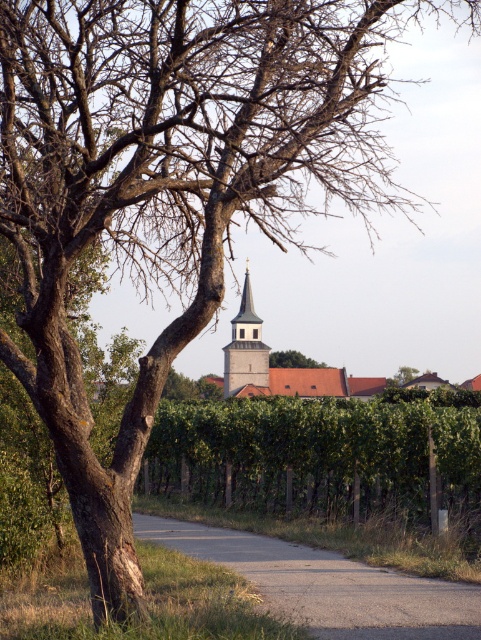
Question: Does green leafy hedge at center appear on the left side of brown rough bark tree at center?

Choices:
 (A) no
 (B) yes

Answer: (A)

Question: In this image, where is asphalt road at center located relative to light gray stone tower at center?

Choices:
 (A) above
 (B) below

Answer: (B)

Question: Which object appears closest to the camera in this image?

Choices:
 (A) asphalt road at center
 (B) green leafy hedge at center

Answer: (A)

Question: Which is farther from the green leafy hedge at center?

Choices:
 (A) brown rough bark tree at center
 (B) light gray stone tower at center
 (C) asphalt road at center

Answer: (A)

Question: Is green leafy hedge at center above light gray stone tower at center?

Choices:
 (A) no
 (B) yes

Answer: (A)

Question: Which point is farther to the camera?

Choices:
 (A) (291, 349)
 (B) (248, 284)
 (C) (405, 580)

Answer: (A)